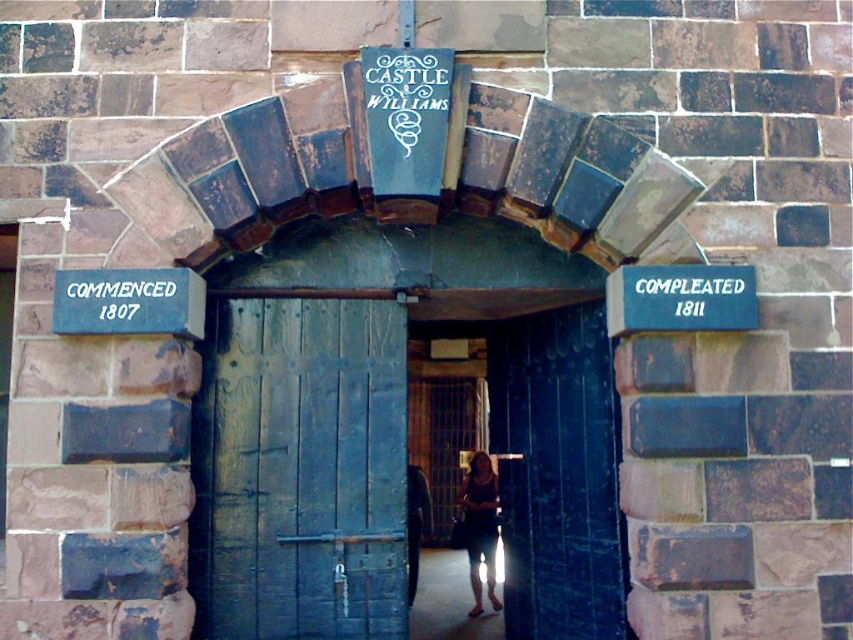
You are standing at the entrance of Castle Williams and want to locate the blue painted wood sign at left. According to the coordinates provided, where should you look relative to the entrance?

The blue painted wood sign at left is located at coordinates point (128, 301), which means it is positioned to the left side of the entrance.

You are a tour guide standing at the entrance of Castle Williams. You need to hand out a map to a visitor who is facing the dark blue wood door at center. Where should the visitor look to find the blue painted wood sign at right relative to the door?

The blue painted wood sign at right is located to the right side of the dark blue wood door at center, and it is 4.46 feet away from the door.